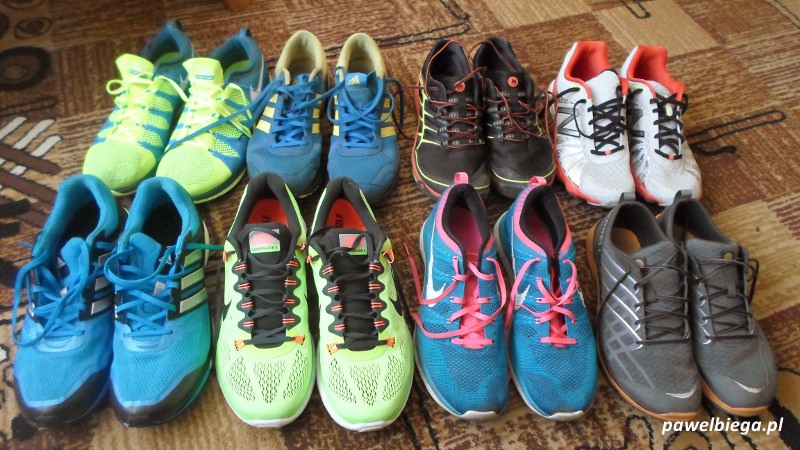
The height and width of the screenshot is (450, 800). I want to click on left foot shoe, so click(x=150, y=373), click(x=370, y=383), click(x=550, y=364), click(x=726, y=347), click(x=677, y=176), click(x=522, y=155), click(x=370, y=154), click(x=210, y=158).